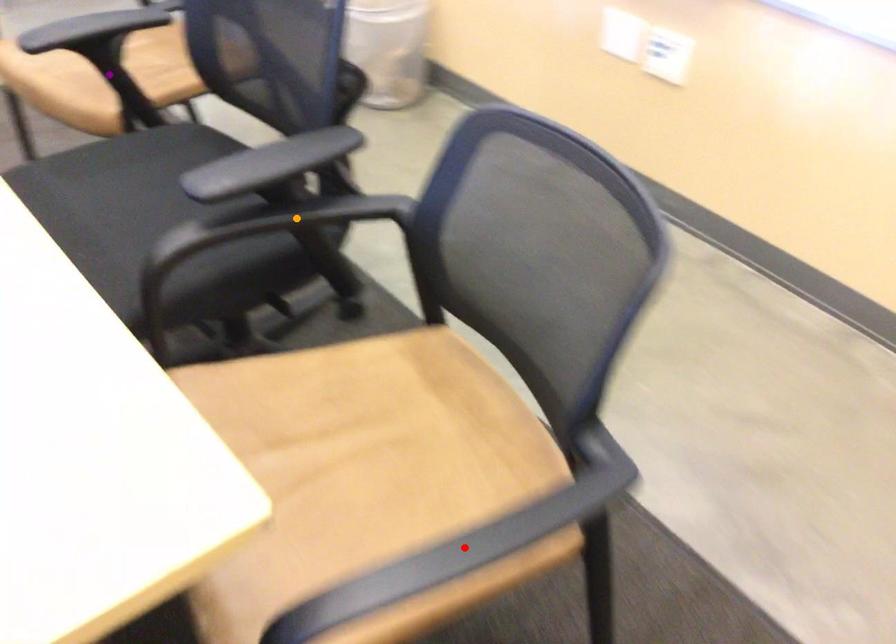
Order these from nearest to farthest:
- purple point
- red point
- orange point

red point → orange point → purple point